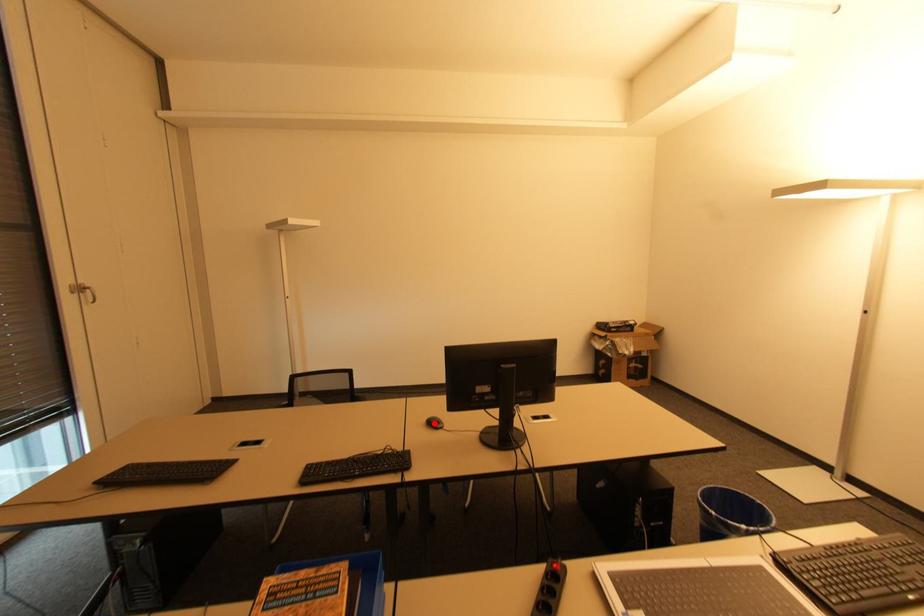
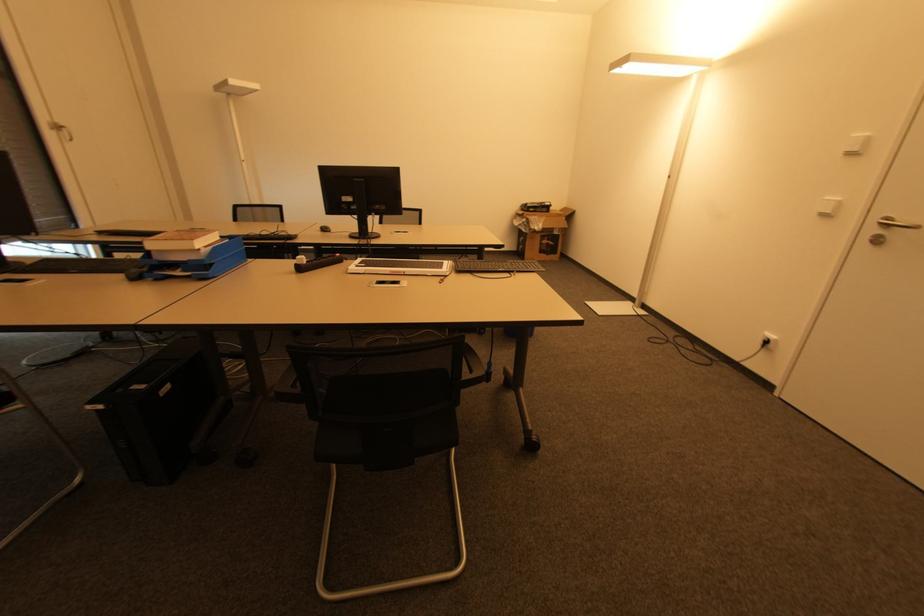
Question: A red point is marked in image1. In image2, is the corresponding 3D point closer to the camera or farther? Reply with the corresponding letter.

Choices:
 (A) The corresponding 3D point is closer.
 (B) The corresponding 3D point is farther.

Answer: (A)